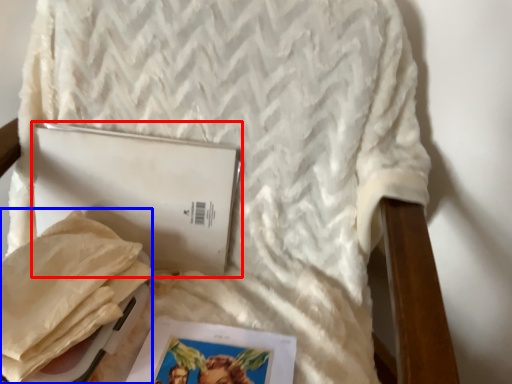
Question: Among these objects, which one is farthest to the camera, journal (highlighted by a red box) or material (highlighted by a blue box)?

Choices:
 (A) journal
 (B) material

Answer: (A)